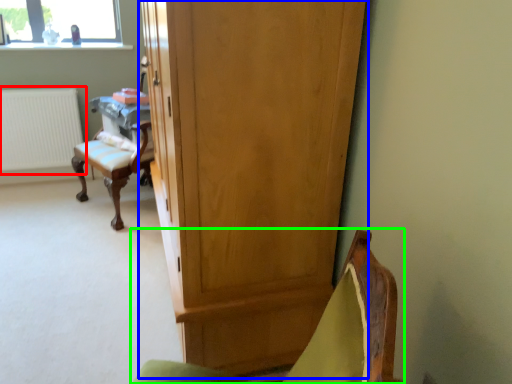
Question: Which object is positioned closest to radiator (highlighted by a red box)? Select from cupboard (highlighted by a blue box) and chair (highlighted by a green box).

Choices:
 (A) cupboard
 (B) chair

Answer: (A)